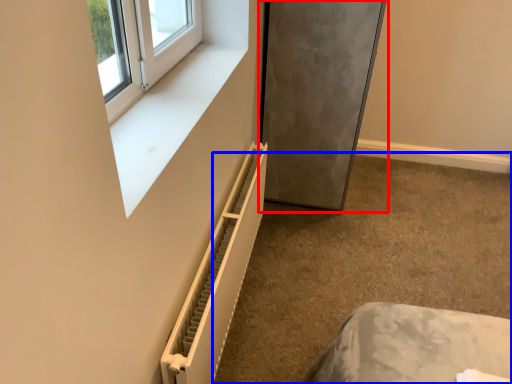
Question: Among these objects, which one is farthest to the camera, fridge (highlighted by a red box) or concrete (highlighted by a blue box)?

Choices:
 (A) fridge
 (B) concrete

Answer: (A)